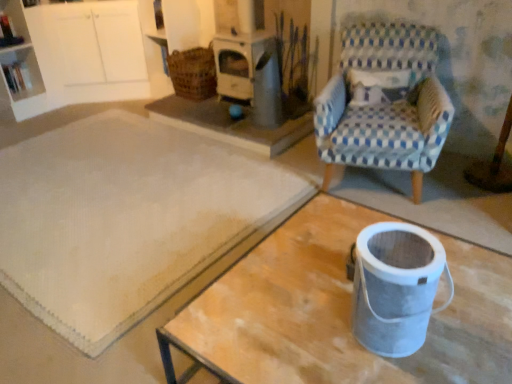
Question: Does white plastic shelf at upper left come in front of white textured rug at center?

Choices:
 (A) no
 (B) yes

Answer: (A)

Question: Could you tell me if white plastic shelf at upper left is turned towards white textured rug at center?

Choices:
 (A) no
 (B) yes

Answer: (B)

Question: Does white plastic shelf at upper left appear on the left side of white textured rug at center?

Choices:
 (A) yes
 (B) no

Answer: (A)

Question: Does white plastic shelf at upper left touch white textured rug at center?

Choices:
 (A) yes
 (B) no

Answer: (B)

Question: Is white plastic shelf at upper left to the right of white textured rug at center from the viewer's perspective?

Choices:
 (A) no
 (B) yes

Answer: (A)

Question: In terms of width, does woven brown basket at upper center look wider or thinner when compared to white plastic shelf at upper left?

Choices:
 (A) thin
 (B) wide

Answer: (B)

Question: In terms of size, does woven brown basket at upper center appear bigger or smaller than white plastic shelf at upper left?

Choices:
 (A) small
 (B) big

Answer: (B)

Question: Which is correct: woven brown basket at upper center is inside white plastic shelf at upper left, or outside of it?

Choices:
 (A) inside
 (B) outside

Answer: (B)

Question: Considering their positions, is woven brown basket at upper center located in front of or behind white plastic shelf at upper left?

Choices:
 (A) front
 (B) behind

Answer: (A)

Question: From the image's perspective, is white plastic shelf at upper left above or below woven brown basket at upper center?

Choices:
 (A) above
 (B) below

Answer: (B)

Question: Would you say white plastic shelf at upper left is to the left or to the right of woven brown basket at upper center in the picture?

Choices:
 (A) right
 (B) left

Answer: (B)

Question: From a real-world perspective, is white plastic shelf at upper left positioned above or below woven brown basket at upper center?

Choices:
 (A) below
 (B) above

Answer: (A)

Question: In the image, is white plastic shelf at upper left positioned in front of or behind woven brown basket at upper center?

Choices:
 (A) front
 (B) behind

Answer: (B)

Question: Based on their sizes in the image, would you say woven brown basket at upper center is bigger or smaller than metallic gray bucket at lower right?

Choices:
 (A) big
 (B) small

Answer: (A)

Question: Looking at their shapes, would you say woven brown basket at upper center is wider or thinner than metallic gray bucket at lower right?

Choices:
 (A) thin
 (B) wide

Answer: (B)